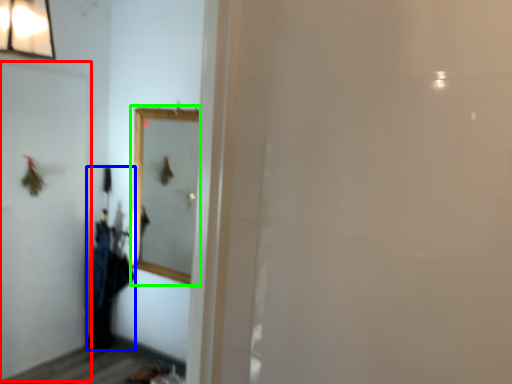
Question: Which object is the farthest from screen door (highlighted by a red box)? Choose among these: laundry (highlighted by a blue box) or mirror (highlighted by a green box).

Choices:
 (A) laundry
 (B) mirror

Answer: (B)